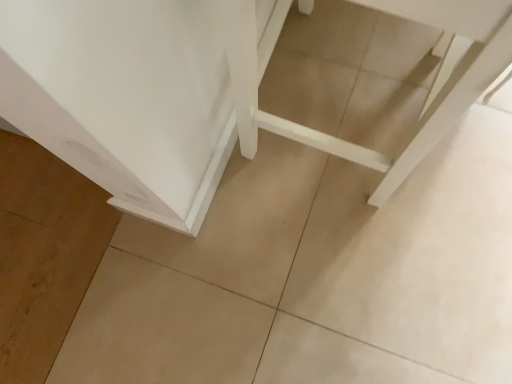
This screenshot has height=384, width=512. What do you see at coordinates (433, 97) in the screenshot?
I see `white matte table at center` at bounding box center [433, 97].

What is the approximate width of white matte table at center?

Result: white matte table at center is 20.10 inches in width.

Locate an element on the screen. This screenshot has width=512, height=384. white matte table at center is located at coordinates (433, 97).

Find the location of a particular element. This screenshot has height=384, width=512. white matte table at center is located at coordinates (433, 97).